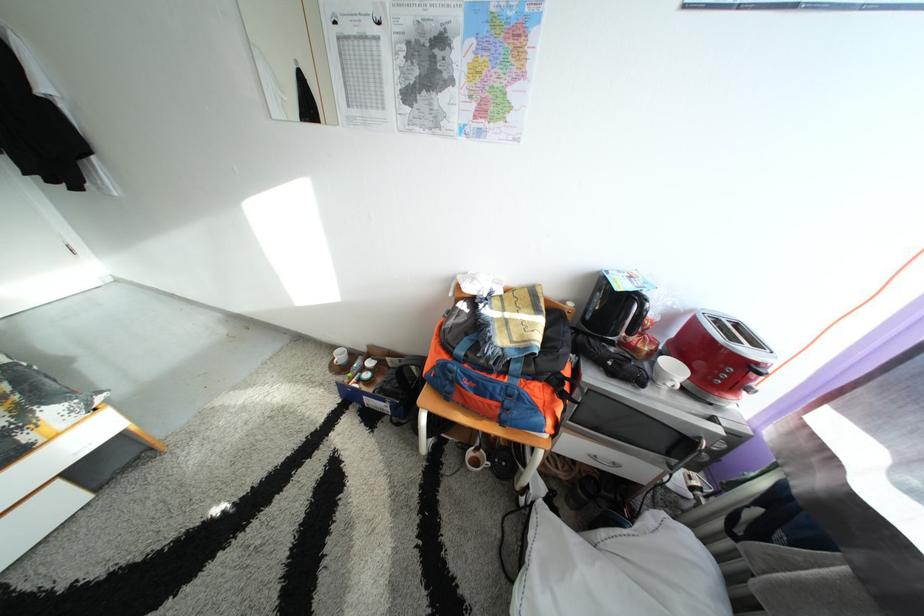
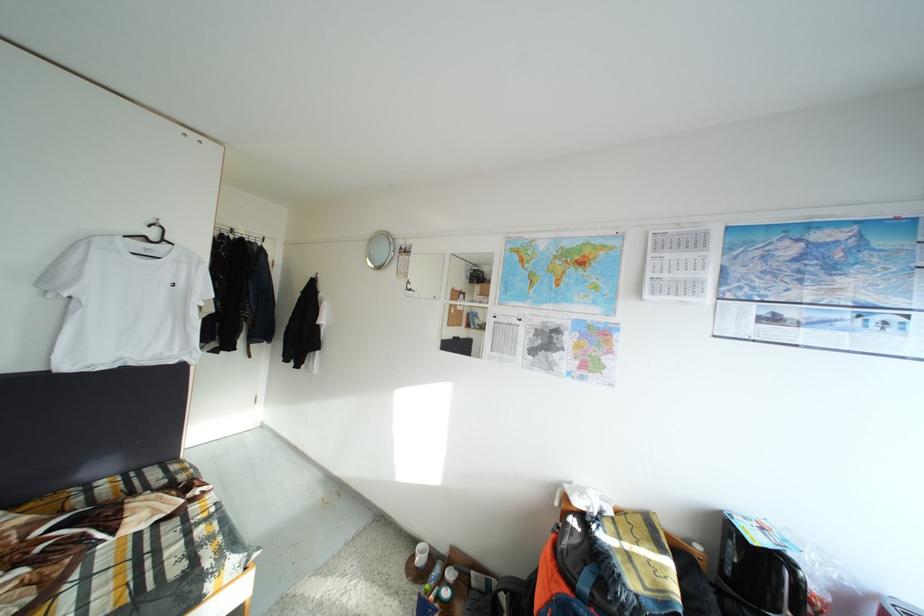
The first image is from the beginning of the video and the second image is from the end. How did the camera likely rotate when shooting the video?

The camera's rotation is toward left-up.